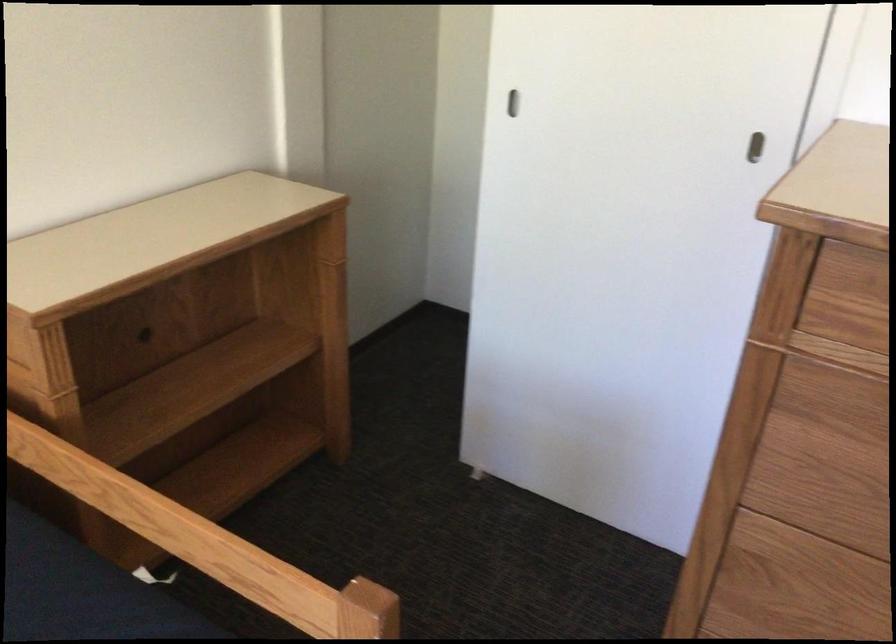
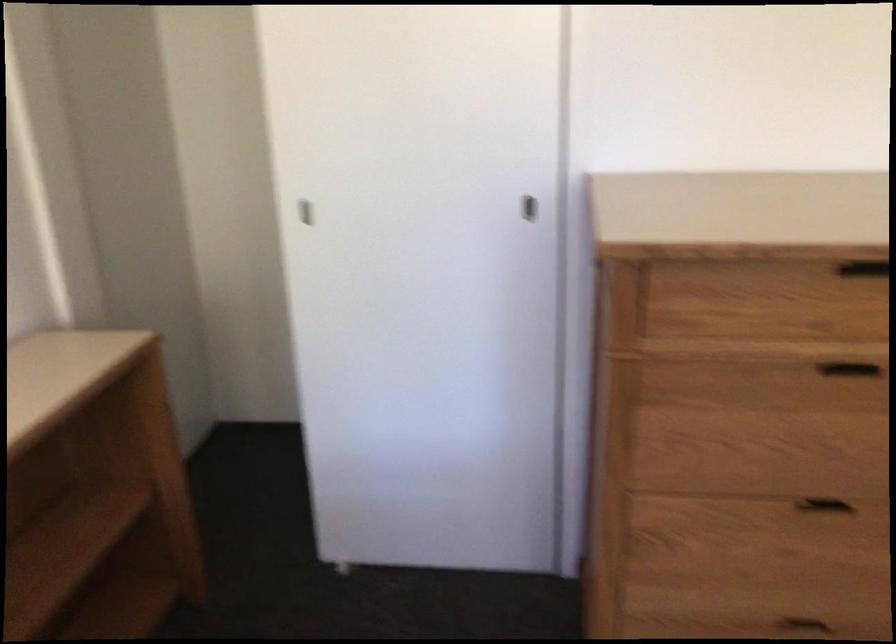
Where in the second image is the point corresponding to [755,147] from the first image?

(530, 209)